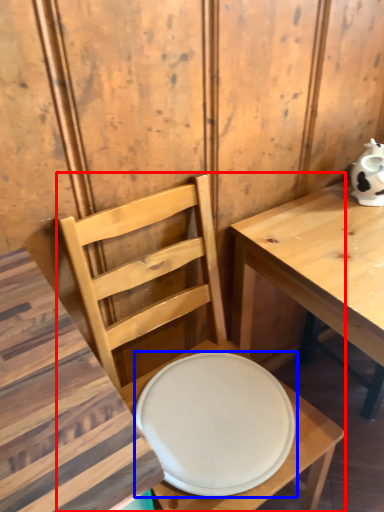
Question: Which point is further to the camera, chair (highlighted by a red box) or plate (highlighted by a blue box)?

Choices:
 (A) chair
 (B) plate

Answer: (B)